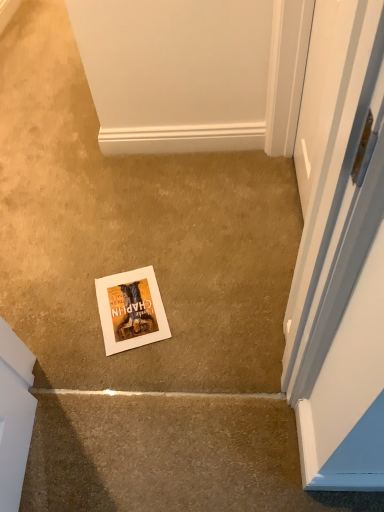
The height and width of the screenshot is (512, 384). I want to click on matte paper postcard at center, so click(x=131, y=310).

Image resolution: width=384 pixels, height=512 pixels. Describe the element at coordinates (131, 310) in the screenshot. I see `matte paper postcard at center` at that location.

Where is `matte paper postcard at center`? This screenshot has height=512, width=384. matte paper postcard at center is located at coordinates (131, 310).